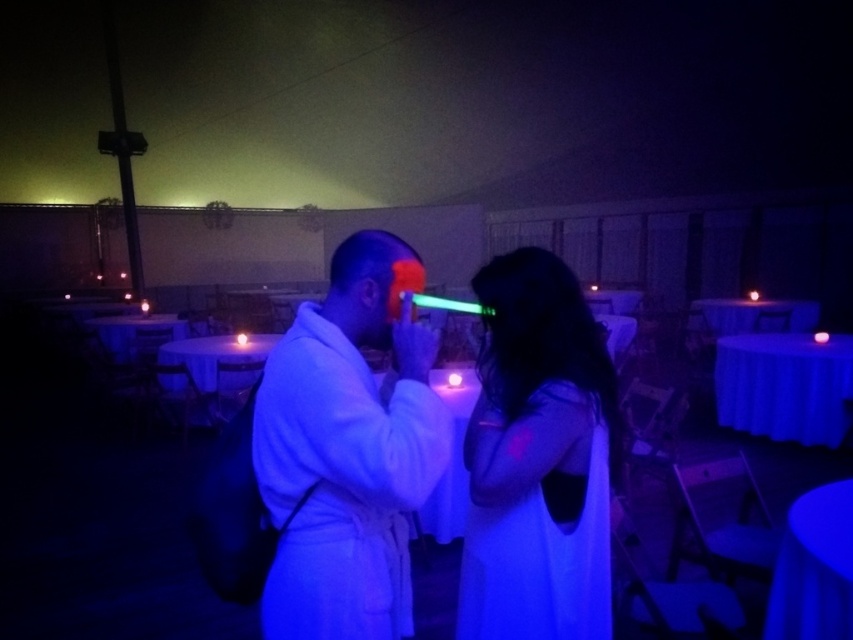
Can you confirm if white matte bathrobe at center is thinner than matte black dress at center?

No, white matte bathrobe at center is not thinner than matte black dress at center.

Can you confirm if white matte bathrobe at center is taller than matte black dress at center?

Yes, white matte bathrobe at center is taller than matte black dress at center.

Does point (285, 563) lie behind point (585, 360)?

No, it is in front of (585, 360).

Where is `white matte bathrobe at center`? This screenshot has width=853, height=640. white matte bathrobe at center is located at coordinates (347, 449).